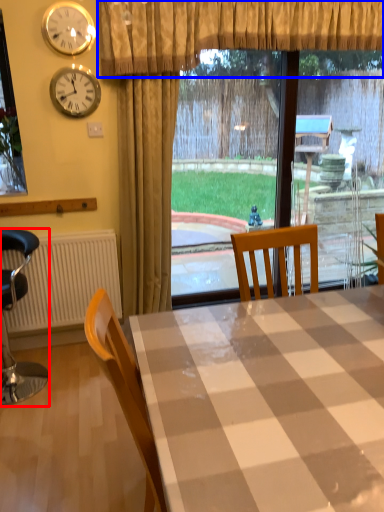
Question: Which object appears closest to the camera in this image, chair (highlighted by a red box) or curtain (highlighted by a blue box)?

Choices:
 (A) chair
 (B) curtain

Answer: (A)